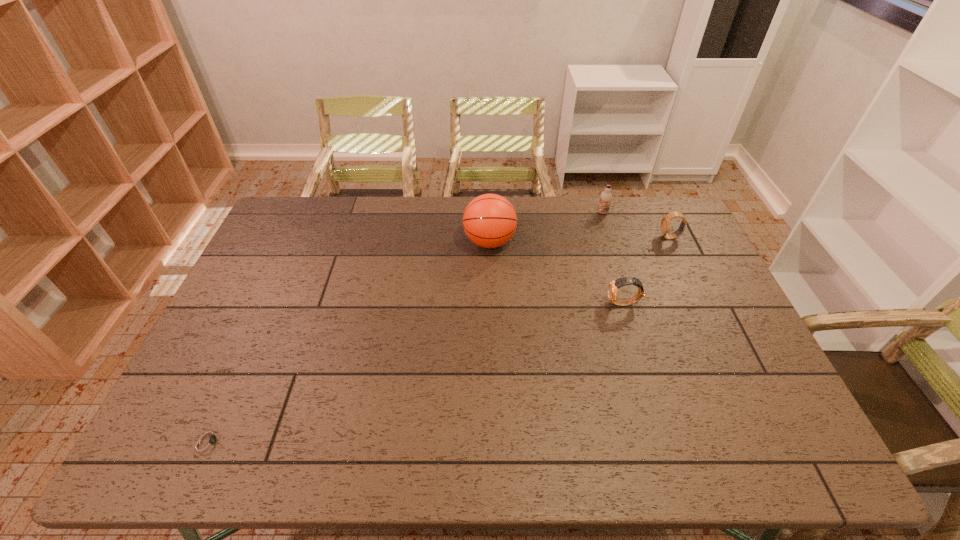
At what (x,y) coordinates should I click in order to perform the action: click on watch that is at the far edge. Please return your answer as a coordinate pair (x, y). The width and height of the screenshot is (960, 540). Looking at the image, I should click on (665, 226).

Identify the location of object that is positioned at the near edge. (209, 440).

The width and height of the screenshot is (960, 540). Identify the location of object at the left edge. (209, 440).

At what (x,y) coordinates should I click in order to perform the action: click on object that is at the right edge. Please return your answer as a coordinate pair (x, y). The height and width of the screenshot is (540, 960). Looking at the image, I should click on (665, 226).

The height and width of the screenshot is (540, 960). What are the coordinates of `object at the near left corner` in the screenshot? It's located at (209, 440).

Locate an element on the screen. Image resolution: width=960 pixels, height=540 pixels. object located in the far right corner section of the desktop is located at coordinates (665, 226).

The height and width of the screenshot is (540, 960). Identify the location of vacant space at the far edge of the desktop. (351, 219).

The image size is (960, 540). In the image, there is a desktop. Identify the location of vacant space at the near edge. (679, 440).

Identify the location of free region at the left edge of the desktop. The height and width of the screenshot is (540, 960). (200, 416).

Where is `vacant region at the right edge`? vacant region at the right edge is located at coordinates (717, 361).